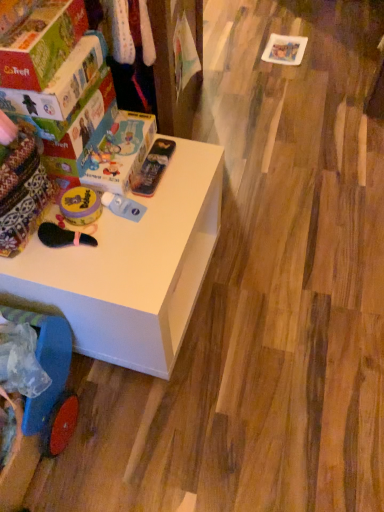
Locate an element on the screen. This screenshot has height=512, width=384. matte cardboard box at upper left, which is counted as the first box, starting from the front is located at coordinates (41, 44).

Measure the distance between point (72, 67) and camera.

A distance of 34.45 inches exists between point (72, 67) and camera.

Identify the location of yellow matte container at left, the first toy in the left-to-right sequence. The height and width of the screenshot is (512, 384). pos(80,205).

Locate an element on the screen. metallic blue pencil case at upper center, which is the 1th toy in right-to-left order is located at coordinates (153, 167).

At what (x,y) coordinates should I click in order to perform the action: click on blue plastic baby carriage at lower left. Please return your answer as a coordinate pair (x, y). The image size is (384, 512). Looking at the image, I should click on (47, 374).

Where is `matte cardboard box at upper left, the 2th box positioned from the back`? This screenshot has height=512, width=384. matte cardboard box at upper left, the 2th box positioned from the back is located at coordinates (41, 44).

Considering the relative sizes of blue plastic baby carriage at lower left and metallic blue pencil case at upper center, the third toy from the left, in the image provided, is blue plastic baby carriage at lower left wider than metallic blue pencil case at upper center, the third toy from the left,?

Correct, the width of blue plastic baby carriage at lower left exceeds that of metallic blue pencil case at upper center, the third toy from the left.

Is blue plastic baby carriage at lower left oriented away from metallic blue pencil case at upper center, which is the 1th toy in right-to-left order?

Absolutely, blue plastic baby carriage at lower left is directed away from metallic blue pencil case at upper center, which is the 1th toy in right-to-left order.

Considering the relative sizes of blue plastic baby carriage at lower left and metallic blue pencil case at upper center, which is the 1th toy in right-to-left order, in the image provided, is blue plastic baby carriage at lower left smaller than metallic blue pencil case at upper center, which is the 1th toy in right-to-left order,?

Incorrect, blue plastic baby carriage at lower left is not smaller in size than metallic blue pencil case at upper center, which is the 1th toy in right-to-left order.

Which is in front, point (19, 310) or point (174, 148)?

Point (19, 310)

Can you tell me how much metallic blue pencil case at upper center, which is the 1th toy in right-to-left order, and yellow matte container at left, the first toy in the left-to-right sequence, differ in facing direction?

The angle between the facing direction of metallic blue pencil case at upper center, which is the 1th toy in right-to-left order, and the facing direction of yellow matte container at left, the first toy in the left-to-right sequence, is 0.000924 degrees.

Would you say metallic blue pencil case at upper center, which is the 1th toy in right-to-left order, is outside yellow matte container at left, the first toy in the left-to-right sequence?

metallic blue pencil case at upper center, which is the 1th toy in right-to-left order, lies outside yellow matte container at left, the first toy in the left-to-right sequence,'s area.

Is metallic blue pencil case at upper center, the third toy from the left, shorter than yellow matte container at left, arranged as the third toy when viewed from the right?

Yes, metallic blue pencil case at upper center, the third toy from the left, is shorter than yellow matte container at left, arranged as the third toy when viewed from the right.

Is metallic blue pencil case at upper center, which is the 1th toy in right-to-left order, positioned with its back to yellow matte container at left, the first toy in the left-to-right sequence?

metallic blue pencil case at upper center, which is the 1th toy in right-to-left order, is not turned away from yellow matte container at left, the first toy in the left-to-right sequence.

The image size is (384, 512). I want to click on table below the matte cardboard box at upper left, which is counted as the first box, starting from the front (from the image's perspective), so click(x=131, y=268).

Is matte cardboard box at upper left, which is counted as the first box, starting from the front, not close to white matte table at upper left?

No, matte cardboard box at upper left, which is counted as the first box, starting from the front, is in close proximity to white matte table at upper left.

Is matte cardboard box at upper left, the 2th box positioned from the back, positioned before white matte table at upper left?

That is True.

Relative to matte cardboard box at upper left, the first box from the back, is yellow matte bubble container at center, which is the 2th toy in right-to-left order, in front or behind?

yellow matte bubble container at center, which is the 2th toy in right-to-left order, is behind matte cardboard box at upper left, the first box from the back.

Is yellow matte bubble container at center, acting as the 2th toy starting from the left, next to matte cardboard box at upper left, the first box from the back, and touching it?

yellow matte bubble container at center, acting as the 2th toy starting from the left, and matte cardboard box at upper left, the first box from the back, are not in contact.

From the picture: Can you confirm if yellow matte bubble container at center, which is the 2th toy in right-to-left order, is smaller than matte cardboard box at upper left, arranged as the second box when viewed from the front?

Indeed, yellow matte bubble container at center, which is the 2th toy in right-to-left order, has a smaller size compared to matte cardboard box at upper left, arranged as the second box when viewed from the front.

From the picture: Considering the relative positions of yellow matte bubble container at center, which is the 2th toy in right-to-left order, and matte cardboard box at upper left, the first box from the back, in the image provided, is yellow matte bubble container at center, which is the 2th toy in right-to-left order, to the left of matte cardboard box at upper left, the first box from the back, from the viewer's perspective?

No.

Can you confirm if white matte table at upper left is taller than matte cardboard box at upper left, the first box from the back?

Correct, white matte table at upper left is much taller as matte cardboard box at upper left, the first box from the back.

Does point (174, 353) lie in front of point (91, 46)?

No, (174, 353) is behind (91, 46).

From the image's perspective, is white matte table at upper left positioned above or below matte cardboard box at upper left, the first box from the back?

white matte table at upper left is below matte cardboard box at upper left, the first box from the back.

How far apart are white matte table at upper left and matte cardboard box at upper left, arranged as the second box when viewed from the front?

They are 16.93 inches apart.

Which object is closer to the camera, white matte table at upper left or matte cardboard box at upper left, which is counted as the first box, starting from the front?

matte cardboard box at upper left, which is counted as the first box, starting from the front.

Would you consider white matte table at upper left to be distant from matte cardboard box at upper left, which is counted as the first box, starting from the front?

No, white matte table at upper left is not far from matte cardboard box at upper left, which is counted as the first box, starting from the front.

From the image's perspective, who appears lower, white matte table at upper left or matte cardboard box at upper left, the 2th box positioned from the back?

white matte table at upper left appears lower in the image.

Which of these two, white matte table at upper left or matte cardboard box at upper left, the 2th box positioned from the back, stands taller?

Standing taller between the two is white matte table at upper left.

Is yellow matte container at left, the first toy in the left-to-right sequence, positioned with its back to metallic blue pencil case at upper center, the third toy from the left?

No, yellow matte container at left, the first toy in the left-to-right sequence, is not facing away from metallic blue pencil case at upper center, the third toy from the left.

Between yellow matte container at left, the first toy in the left-to-right sequence, and metallic blue pencil case at upper center, the third toy from the left, which one appears on the right side from the viewer's perspective?

metallic blue pencil case at upper center, the third toy from the left.

Is the depth of yellow matte container at left, the first toy in the left-to-right sequence, greater than that of metallic blue pencil case at upper center, the third toy from the left?

No.

In order to click on the 1st toy below the metallic blue pencil case at upper center, which is the 1th toy in right-to-left order (from the image's perspective) in this screenshot , I will do `click(80, 205)`.

Which toy is the 3rd one when counting from the right side of the blue plastic baby carriage at lower left? Please provide its 2D coordinates.

[(153, 167)]

Locate an element on the screen. The image size is (384, 512). toy that is the 2nd object above the metallic blue pencil case at upper center, the third toy from the left (from a real-world perspective) is located at coordinates (80, 205).

When comparing their distances from matte cardboard box at upper left, arranged as the second box when viewed from the front, does white matte table at upper left or metallic blue pencil case at upper center, which is the 1th toy in right-to-left order, seem closer?

Among the two, metallic blue pencil case at upper center, which is the 1th toy in right-to-left order, is located nearer to matte cardboard box at upper left, arranged as the second box when viewed from the front.

Based on their spatial positions, is metallic blue pencil case at upper center, which is the 1th toy in right-to-left order, or yellow matte bubble container at center, acting as the 2th toy starting from the left, further from matte cardboard box at upper left, the 2th box positioned from the back?

metallic blue pencil case at upper center, which is the 1th toy in right-to-left order, is positioned further to the anchor matte cardboard box at upper left, the 2th box positioned from the back.

Which object lies nearer to the anchor point yellow matte bubble container at center, acting as the 2th toy starting from the left, metallic blue pencil case at upper center, which is the 1th toy in right-to-left order, or blue plastic baby carriage at lower left?

Based on the image, metallic blue pencil case at upper center, which is the 1th toy in right-to-left order, appears to be nearer to yellow matte bubble container at center, acting as the 2th toy starting from the left.

When comparing their distances from blue plastic baby carriage at lower left, does metallic blue pencil case at upper center, which is the 1th toy in right-to-left order, or white matte table at upper left seem closer?

white matte table at upper left.

Looking at the image, which one is located further to matte cardboard box at upper left, arranged as the second box when viewed from the front, matte cardboard box at upper left, the 2th box positioned from the back, or metallic blue pencil case at upper center, the third toy from the left?

Among the two, metallic blue pencil case at upper center, the third toy from the left, is located further to matte cardboard box at upper left, arranged as the second box when viewed from the front.

From the image, which object appears to be farther from yellow matte container at left, arranged as the third toy when viewed from the right, white matte table at upper left or blue plastic baby carriage at lower left?

blue plastic baby carriage at lower left.

Estimate the real-world distances between objects in this image. Which object is closer to matte cardboard box at upper left, arranged as the second box when viewed from the front, metallic blue pencil case at upper center, the third toy from the left, or blue plastic baby carriage at lower left?

Based on the image, metallic blue pencil case at upper center, the third toy from the left, appears to be nearer to matte cardboard box at upper left, arranged as the second box when viewed from the front.

Looking at this image, considering their positions, is metallic blue pencil case at upper center, which is the 1th toy in right-to-left order, positioned further to matte cardboard box at upper left, the first box from the back, than matte cardboard box at upper left, the 2th box positioned from the back?

metallic blue pencil case at upper center, which is the 1th toy in right-to-left order, is further to matte cardboard box at upper left, the first box from the back.

You are a GUI agent. You are given a task and a screenshot of the screen. Output one action in this format:
    pyautogui.click(x=<x>, y=<y>)
    Task: Click on the table between matte cardboard box at upper left, which is counted as the first box, starting from the front, and blue plastic baby carriage at lower left, in the vertical direction
    The height and width of the screenshot is (512, 384).
    Given the screenshot: What is the action you would take?
    pyautogui.click(x=131, y=268)

Identify the location of table between metallic blue pencil case at upper center, which is the 1th toy in right-to-left order, and blue plastic baby carriage at lower left, in the vertical direction. Image resolution: width=384 pixels, height=512 pixels. (131, 268).

Image resolution: width=384 pixels, height=512 pixels. Find the location of `box between matte cardboard box at upper left, the 2th box positioned from the back, and yellow matte bubble container at center, acting as the 2th toy starting from the left, from top to bottom`. box between matte cardboard box at upper left, the 2th box positioned from the back, and yellow matte bubble container at center, acting as the 2th toy starting from the left, from top to bottom is located at coordinates (61, 83).

What are the coordinates of `box positioned between matte cardboard box at upper left, the 2th box positioned from the back, and metallic blue pencil case at upper center, which is the 1th toy in right-to-left order, from near to far` in the screenshot? It's located at (61, 83).